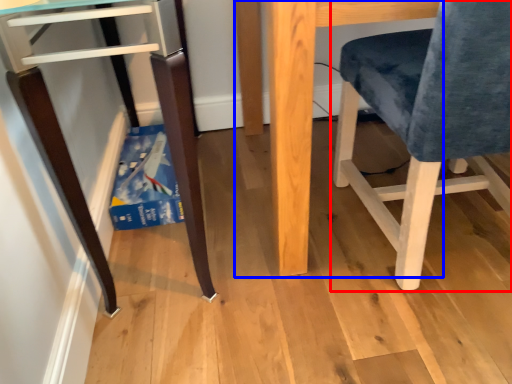
Question: Which object is closer to the camera taking this photo, chair (highlighted by a red box) or table (highlighted by a blue box)?

Choices:
 (A) chair
 (B) table

Answer: (A)